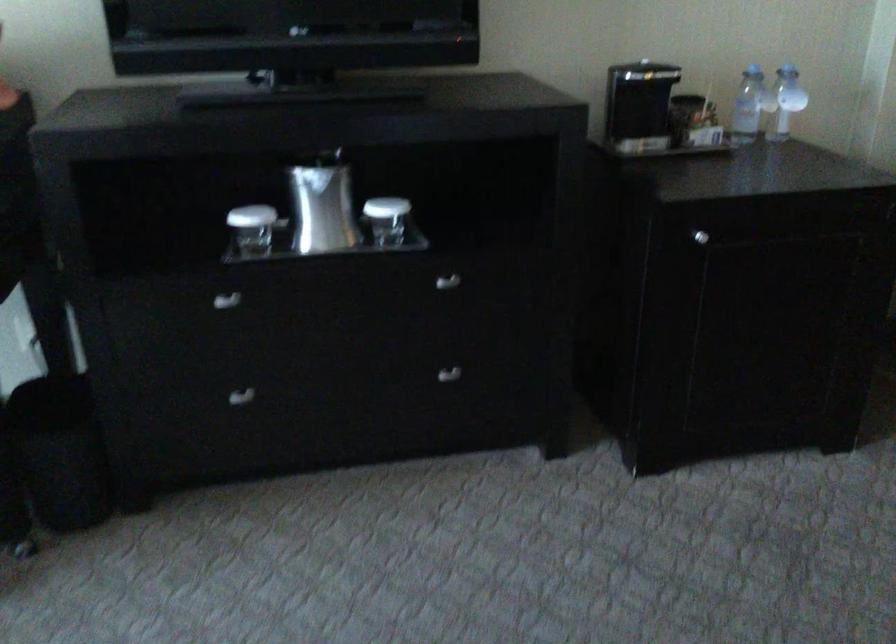
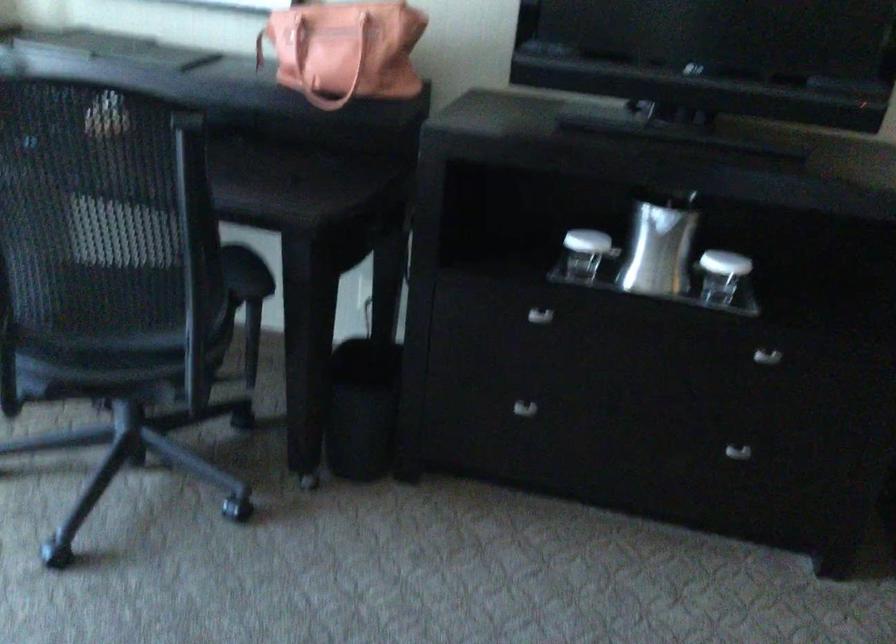
Where in the second image is the point corresponding to the point at 383,218 from the first image?

(721, 275)